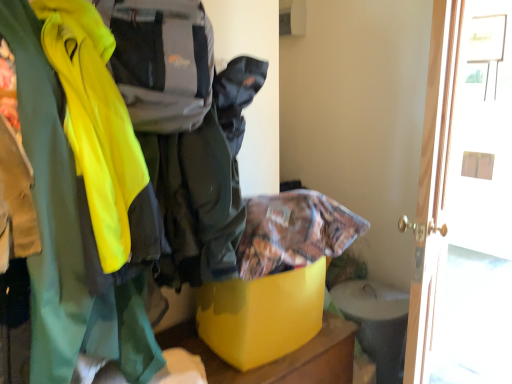
Question: From a real-world perspective, is yellow plastic storage box at center above or below white glossy door at right?

Choices:
 (A) below
 (B) above

Answer: (A)

Question: Is yellow plastic storage box at center spatially inside white glossy door at right, or outside of it?

Choices:
 (A) inside
 (B) outside

Answer: (B)

Question: Which object is positioned closest to the printed fabric bag at center?

Choices:
 (A) yellow plastic storage box at center
 (B) white glossy door at right

Answer: (A)

Question: Which object is the closest to the white glossy door at right?

Choices:
 (A) yellow plastic storage box at center
 (B) printed fabric bag at center

Answer: (A)